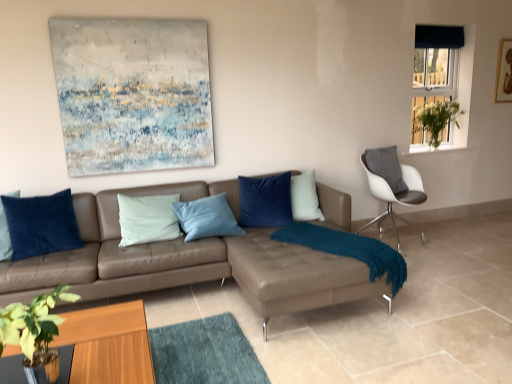
Question: Is point (397, 284) positioned closer to the camera than point (256, 185)?

Choices:
 (A) farther
 (B) closer

Answer: (B)

Question: From a real-world perspective, is teal fuzzy blanket at lower right above or below velvet blue pillow at center, which is counted as the first pillow, starting from the back?

Choices:
 (A) below
 (B) above

Answer: (A)

Question: Considering the real-world distances, which object is farthest from the dark blue velvet curtain at upper right?

Choices:
 (A) velvet blue pillow at center, which is the 1th pillow from right to left
 (B) green leafy plant at lower left
 (C) velvet blue pillow at left, marked as the 1th pillow in a left-to-right arrangement
 (D) brown leather couch at center
 (E) wooden picture frame at upper right

Answer: (B)

Question: Estimate the real-world distances between objects in this image. Which object is closer to the blue fabric curtain at upper right?

Choices:
 (A) velvet blue pillow at left, arranged as the second pillow when viewed from the right
 (B) wooden coffee table at lower left
 (C) brown leather footrest at center
 (D) teal fuzzy blanket at lower right
 (E) green leafy plant at lower left

Answer: (D)